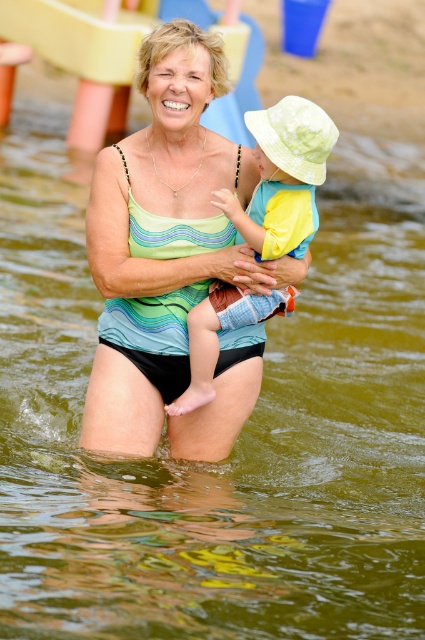
Who is positioned more to the left, matte green tank top at center or light blue denim shorts at center?

matte green tank top at center

Between point (218, 260) and point (306, 196), which one is positioned behind?

The point (218, 260) is behind.

Locate an element on the screen. The image size is (425, 640). matte green tank top at center is located at coordinates (178, 140).

You are a GUI agent. You are given a task and a screenshot of the screen. Output one action in this format:
    pyautogui.click(x=<x>, y=<y>)
    Task: Click on the matte green tank top at center
    The width and height of the screenshot is (425, 640).
    Given the screenshot: What is the action you would take?
    pyautogui.click(x=178, y=140)